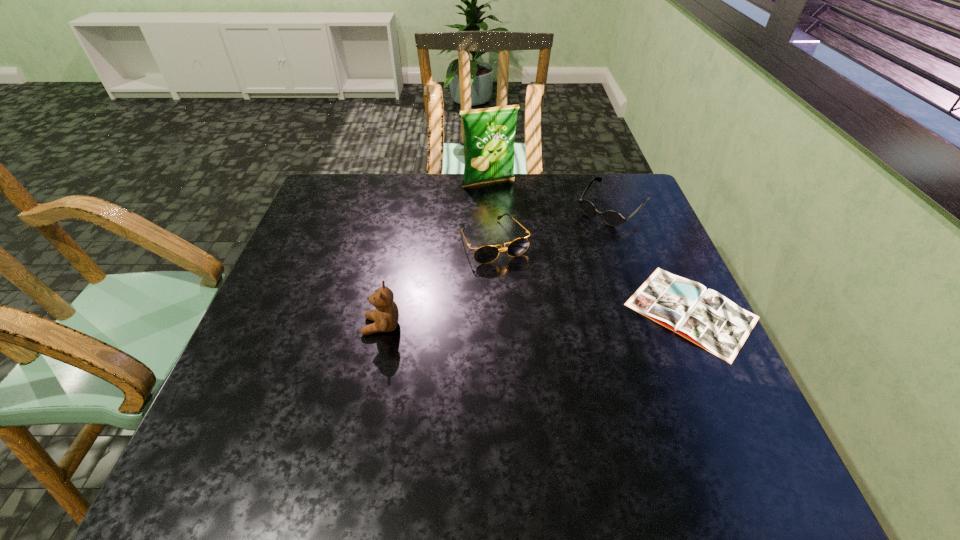
Find the location of a particular element. This screenshot has height=540, width=960. vacant point located 0.230m on the lenses of the right sunglasses is located at coordinates (553, 267).

The height and width of the screenshot is (540, 960). I want to click on vacant region located on the lenses of the right sunglasses, so click(555, 265).

In order to click on free space located on the lenses of the right sunglasses in this screenshot , I will do `click(560, 261)`.

Where is `vacant space located on the front-facing side of the tallest object`? Image resolution: width=960 pixels, height=540 pixels. vacant space located on the front-facing side of the tallest object is located at coordinates (516, 225).

The image size is (960, 540). In order to click on vacant space situated on the front-facing side of the tallest object in this screenshot , I will do `click(519, 231)`.

You are a GUI agent. You are given a task and a screenshot of the screen. Output one action in this format:
    pyautogui.click(x=<x>, y=<y>)
    Task: Click on the free space located 0.220m on the front-facing side of the tallest object
    The image size is (960, 540).
    Given the screenshot: What is the action you would take?
    pyautogui.click(x=519, y=231)

Find the location of a particular element. The image size is (960, 540). blank space located 0.100m on the front-facing side of the left sunglasses is located at coordinates (521, 289).

Locate an element on the screen. This screenshot has height=540, width=960. blank area located on the front-facing side of the left sunglasses is located at coordinates (577, 386).

The height and width of the screenshot is (540, 960). Find the location of `vacant space located 0.180m on the front-facing side of the left sunglasses`. vacant space located 0.180m on the front-facing side of the left sunglasses is located at coordinates tap(534, 313).

Where is `sunglasses that is at the far edge`? sunglasses that is at the far edge is located at coordinates (612, 218).